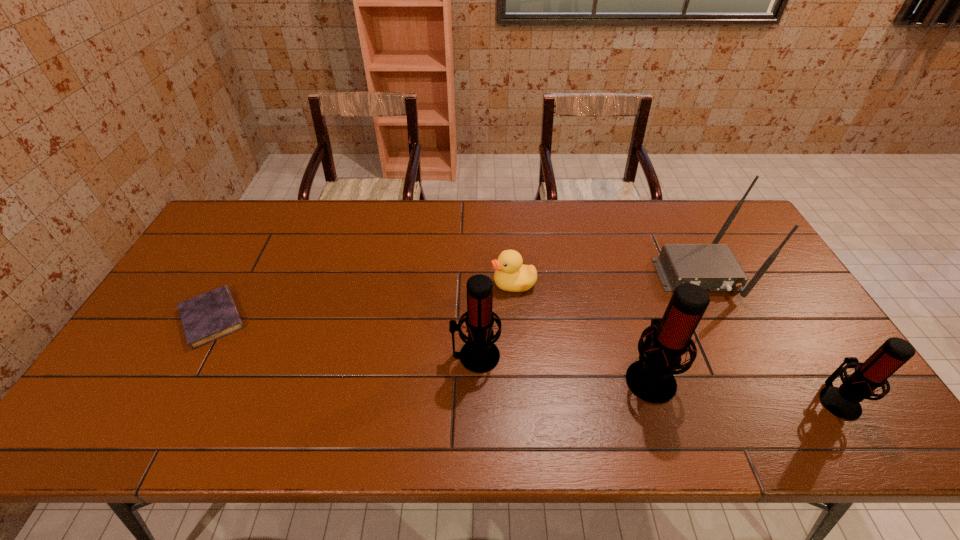
Please point a spot on the left to add another microphone. Please provide its 2D coordinates. Your answer should be formatted as a tuple, i.e. [(x, y)], where the tuple contains the x and y coordinates of a point satisfying the conditions above.

[(315, 336)]